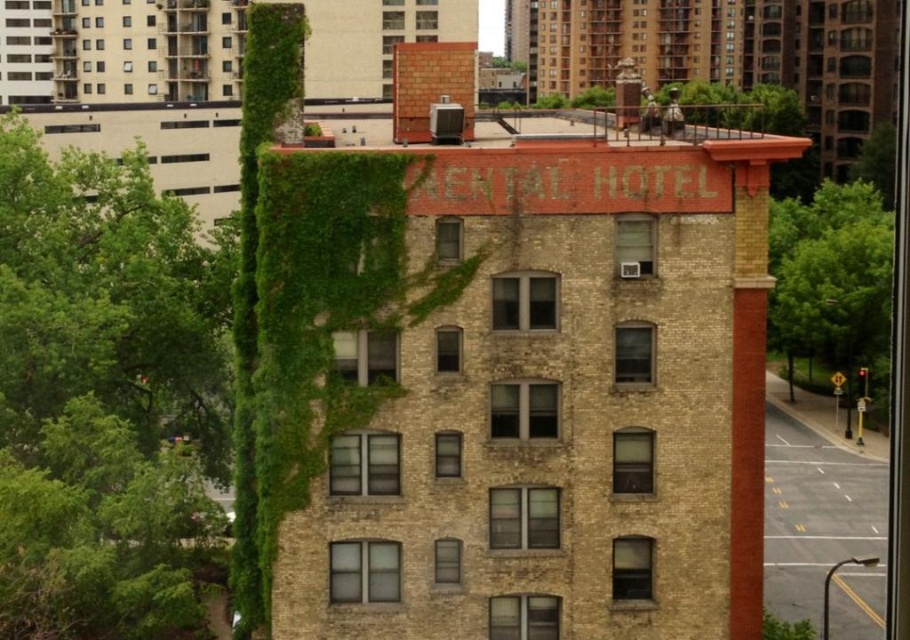
Question: Among these points, which one is farthest from the camera?

Choices:
 (A) (130, 264)
 (B) (886, 296)

Answer: (B)

Question: Is green leafy tree at left above green leafy tree at right?

Choices:
 (A) yes
 (B) no

Answer: (A)

Question: Where is green leafy tree at left located in relation to green leafy tree at right in the image?

Choices:
 (A) right
 (B) left

Answer: (B)

Question: Is green leafy tree at left below green leafy tree at right?

Choices:
 (A) yes
 (B) no

Answer: (B)

Question: Which point is farther to the camera?

Choices:
 (A) (800, 301)
 (B) (123, 214)

Answer: (A)